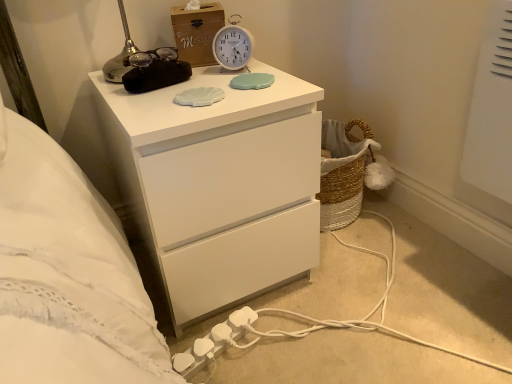
Question: Is white matte chest of drawers at upper center inside white plastic extension cord at lower center?

Choices:
 (A) no
 (B) yes

Answer: (A)

Question: Can you confirm if white plastic extension cord at lower center is smaller than white matte chest of drawers at upper center?

Choices:
 (A) no
 (B) yes

Answer: (B)

Question: Does white plastic extension cord at lower center have a lesser width compared to white matte chest of drawers at upper center?

Choices:
 (A) yes
 (B) no

Answer: (A)

Question: From a real-world perspective, is white plastic extension cord at lower center positioned under white matte chest of drawers at upper center based on gravity?

Choices:
 (A) no
 (B) yes

Answer: (B)

Question: Is white plastic extension cord at lower center behind white matte chest of drawers at upper center?

Choices:
 (A) no
 (B) yes

Answer: (B)

Question: From the image's perspective, is white plastic alarm clock at upper center located above or below woodenmaterial/texturebox at upper center?

Choices:
 (A) below
 (B) above

Answer: (A)

Question: Considering the positions of white plastic alarm clock at upper center and woodenmaterial/texturebox at upper center in the image, is white plastic alarm clock at upper center taller or shorter than woodenmaterial/texturebox at upper center?

Choices:
 (A) short
 (B) tall

Answer: (A)

Question: Looking at their shapes, would you say white plastic alarm clock at upper center is wider or thinner than woodenmaterial/texturebox at upper center?

Choices:
 (A) thin
 (B) wide

Answer: (A)

Question: From a real-world perspective, relative to woodenmaterial/texturebox at upper center, is white plastic alarm clock at upper center vertically above or below?

Choices:
 (A) below
 (B) above

Answer: (A)

Question: From their relative heights in the image, would you say woodenmaterial/texturebox at upper center is taller or shorter than white matte chest of drawers at upper center?

Choices:
 (A) tall
 (B) short

Answer: (B)

Question: From the image's perspective, relative to white matte chest of drawers at upper center, is woodenmaterial/texturebox at upper center above or below?

Choices:
 (A) below
 (B) above

Answer: (B)

Question: In terms of width, does woodenmaterial/texturebox at upper center look wider or thinner when compared to white matte chest of drawers at upper center?

Choices:
 (A) wide
 (B) thin

Answer: (B)

Question: From a real-world perspective, is woodenmaterial/texturebox at upper center positioned above or below white matte chest of drawers at upper center?

Choices:
 (A) below
 (B) above

Answer: (B)

Question: From the image's perspective, is white matte chest of drawers at upper center positioned above or below white plastic extension cord at lower center?

Choices:
 (A) below
 (B) above

Answer: (B)

Question: Which is correct: white matte chest of drawers at upper center is inside white plastic extension cord at lower center, or outside of it?

Choices:
 (A) outside
 (B) inside

Answer: (A)